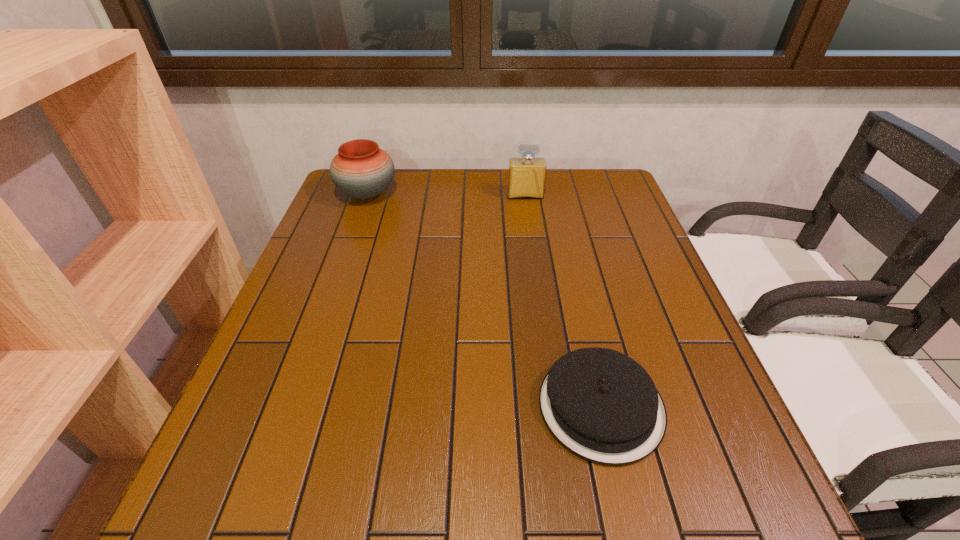
Find the location of a particular element. perfume is located at coordinates (526, 175).

Locate an element on the screen. Image resolution: width=960 pixels, height=540 pixels. pottery is located at coordinates (362, 170).

Locate an element on the screen. pancake is located at coordinates (603, 406).

Locate an element on the screen. the nearest object is located at coordinates point(603,406).

Image resolution: width=960 pixels, height=540 pixels. What are the coordinates of `vacant space situated on the front-facing side of the perfume` in the screenshot? It's located at (531, 234).

This screenshot has height=540, width=960. What are the coordinates of `vacant space located 0.200m on the right of the pottery` in the screenshot? It's located at (463, 195).

You are a GUI agent. You are given a task and a screenshot of the screen. Output one action in this format:
    pyautogui.click(x=<x>, y=<y>)
    Task: Click on the free space located on the back of the shortest object
    
    Given the screenshot: What is the action you would take?
    click(575, 292)

I want to click on perfume at the far edge, so click(526, 175).

Locate an element on the screen. pottery that is at the far edge is located at coordinates (362, 170).

The image size is (960, 540). I want to click on object at the left edge, so click(362, 170).